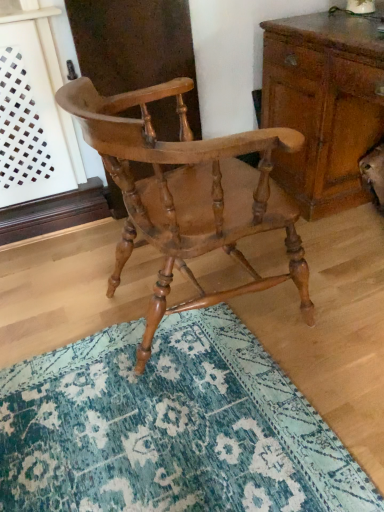
Question: Is light brown wood chair at center a part of teal textured rug at center?

Choices:
 (A) no
 (B) yes

Answer: (A)

Question: Is teal textured rug at center bigger than light brown wood chair at center?

Choices:
 (A) no
 (B) yes

Answer: (A)

Question: Is teal textured rug at center looking in the opposite direction of light brown wood chair at center?

Choices:
 (A) no
 (B) yes

Answer: (A)

Question: Does teal textured rug at center appear on the right side of light brown wood chair at center?

Choices:
 (A) yes
 (B) no

Answer: (B)

Question: Does teal textured rug at center have a lesser height compared to light brown wood chair at center?

Choices:
 (A) yes
 (B) no

Answer: (A)

Question: Based on their positions, is teal textured rug at center located to the left or right of wooden chest of drawers at right?

Choices:
 (A) right
 (B) left

Answer: (B)

Question: Considering the positions of teal textured rug at center and wooden chest of drawers at right in the image, is teal textured rug at center taller or shorter than wooden chest of drawers at right?

Choices:
 (A) tall
 (B) short

Answer: (B)

Question: From the image's perspective, is teal textured rug at center located above or below wooden chest of drawers at right?

Choices:
 (A) below
 (B) above

Answer: (A)

Question: From a real-world perspective, relative to wooden chest of drawers at right, is teal textured rug at center vertically above or below?

Choices:
 (A) below
 (B) above

Answer: (A)

Question: From their relative heights in the image, would you say teal textured rug at center is taller or shorter than light brown wood chair at center?

Choices:
 (A) tall
 (B) short

Answer: (B)

Question: Is point (6, 404) positioned closer to the camera than point (206, 184)?

Choices:
 (A) farther
 (B) closer

Answer: (B)

Question: Choose the correct answer: Is teal textured rug at center inside light brown wood chair at center or outside it?

Choices:
 (A) outside
 (B) inside

Answer: (A)

Question: Looking at the image, does teal textured rug at center seem bigger or smaller compared to light brown wood chair at center?

Choices:
 (A) big
 (B) small

Answer: (B)

Question: Considering the positions of wooden chest of drawers at right and light brown wood chair at center in the image, is wooden chest of drawers at right wider or thinner than light brown wood chair at center?

Choices:
 (A) thin
 (B) wide

Answer: (B)

Question: In terms of size, does wooden chest of drawers at right appear bigger or smaller than light brown wood chair at center?

Choices:
 (A) big
 (B) small

Answer: (A)